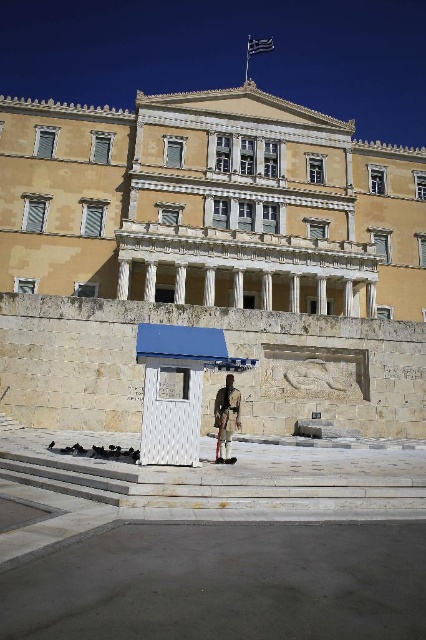
At what (x,y) coordinates should I click in order to perform the action: click on yellow stone building at center. Please return your answer as a coordinate pair (x, y). Image resolution: width=426 pixels, height=640 pixels. Looking at the image, I should click on (210, 205).

Does point (394, 227) come behind point (229, 381)?

Yes, it is.

The width and height of the screenshot is (426, 640). In order to click on yellow stone building at center in this screenshot , I will do `click(210, 205)`.

Is white plastic bus stop at center bigger than white uniform at center?

Correct, white plastic bus stop at center is larger in size than white uniform at center.

Which of these two, white plastic bus stop at center or white uniform at center, stands taller?

Standing taller between the two is white plastic bus stop at center.

Does point (170, 324) come closer to viewer compared to point (227, 460)?

No.

Locate an element on the screen. Image resolution: width=426 pixels, height=640 pixels. white plastic bus stop at center is located at coordinates (176, 388).

Does yellow stone building at center appear on the left side of white plastic bus stop at center?

No, yellow stone building at center is not to the left of white plastic bus stop at center.

Is yellow stone building at center further to camera compared to white plastic bus stop at center?

That is True.

Find the location of `yellow stone building at center`. yellow stone building at center is located at coordinates (210, 205).

Locate an element on the screen. yellow stone building at center is located at coordinates 210,205.